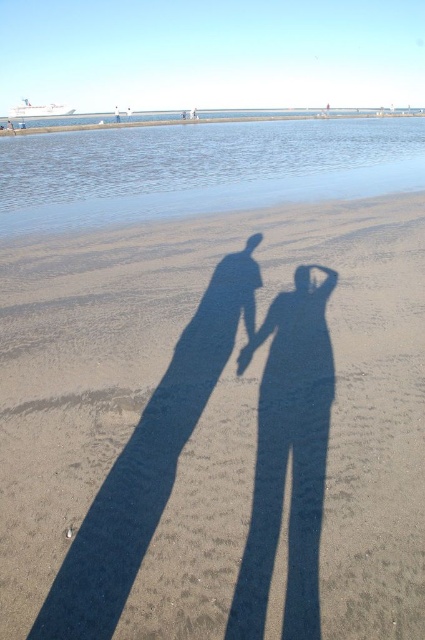
Does dark sand at center lie in front of smooth skin hand at center?

Yes, it is in front of smooth skin hand at center.

Who is positioned more to the left, dark sand at center or smooth skin hand at center?

Positioned to the left is dark sand at center.

Does point (53, 621) come farther from viewer compared to point (238, 353)?

That is False.

The width and height of the screenshot is (425, 640). I want to click on dark sand at center, so click(x=215, y=428).